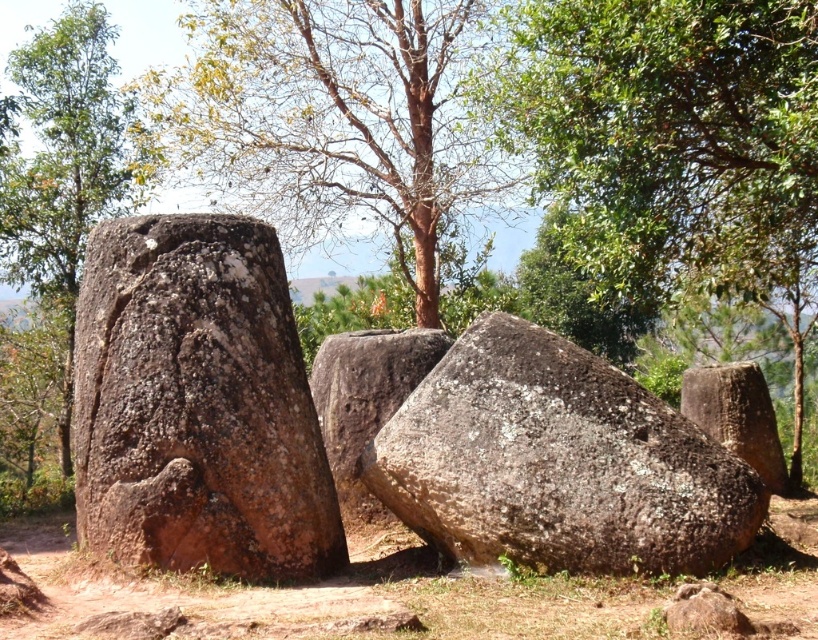
Question: Which point appears closest to the camera in this image?

Choices:
 (A) (722, 364)
 (B) (711, 570)
 (C) (29, 248)

Answer: (B)

Question: Does brown rough stone at left appear on the right side of brown rough boulder at right?

Choices:
 (A) yes
 (B) no

Answer: (B)

Question: Which point is closer to the camera taking this photo?

Choices:
 (A) (79, 300)
 (B) (690, 540)

Answer: (B)

Question: Is brown rough rock at center bigger than green rough bark tree at left?

Choices:
 (A) yes
 (B) no

Answer: (B)

Question: Is brown bark tree at center to the right of brown rough rock at center from the viewer's perspective?

Choices:
 (A) yes
 (B) no

Answer: (B)

Question: Which point is closer to the camera?

Choices:
 (A) brown rough stone at left
 (B) brown rough boulder at center
 (C) green rough bark tree at left

Answer: (A)